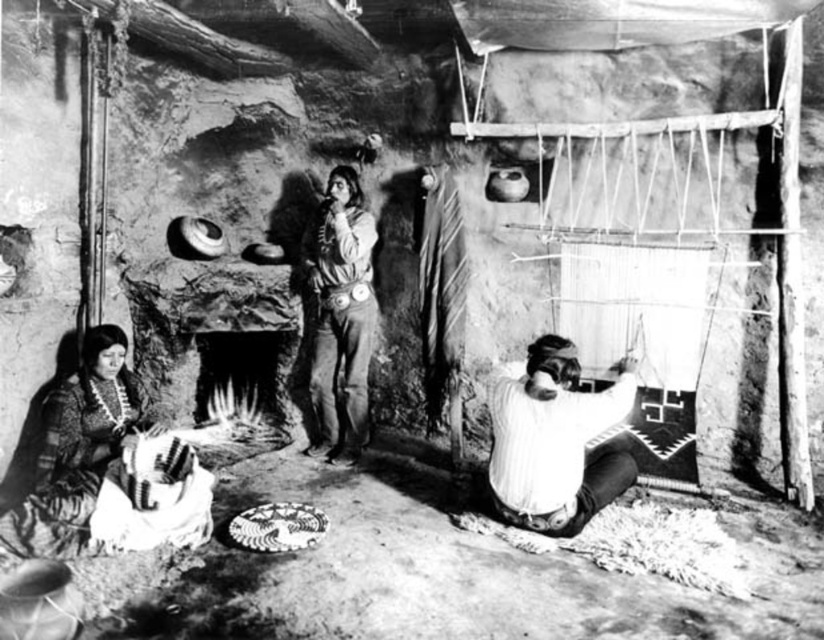
You are an anthropologist visiting this community and need to document the clothing items. You see the white striped shirt at lower right and the smooth leather jacket at center. Which clothing item is positioned more to the east in the scene?

Result: The white striped shirt at lower right is positioned to the east of the smooth leather jacket at center, so it is more to the east.

You are standing in the room and want to move from the point at coordinates point (x=261, y=353) to the point at coordinates point (x=377, y=317). Which direction should you move in to reach your destination?

To move from point (x=261, y=353) to point (x=377, y=317), you should move northeast. This is because point (x=261, y=353) is behind point (x=377, y=317), indicating that the destination is in the northeast direction relative to the starting point.